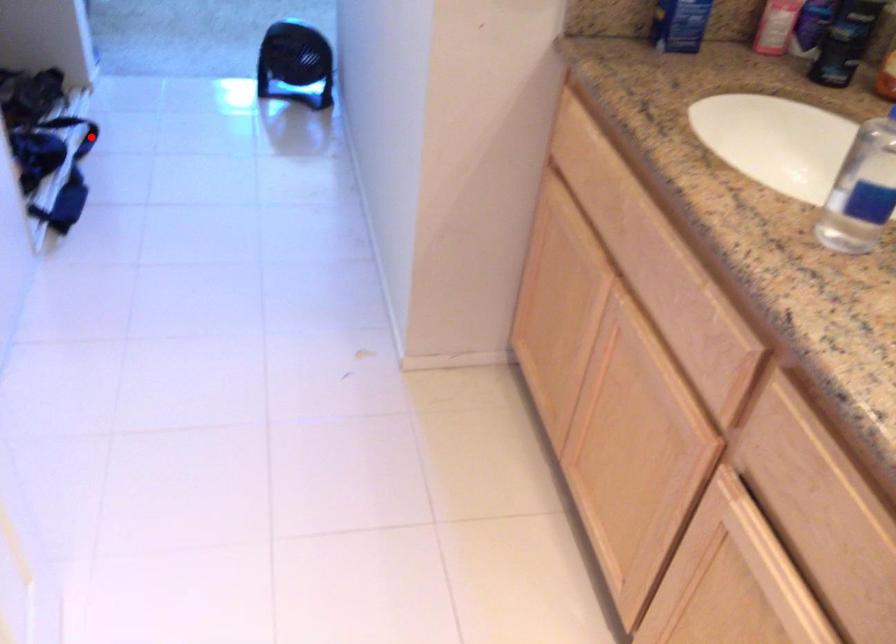
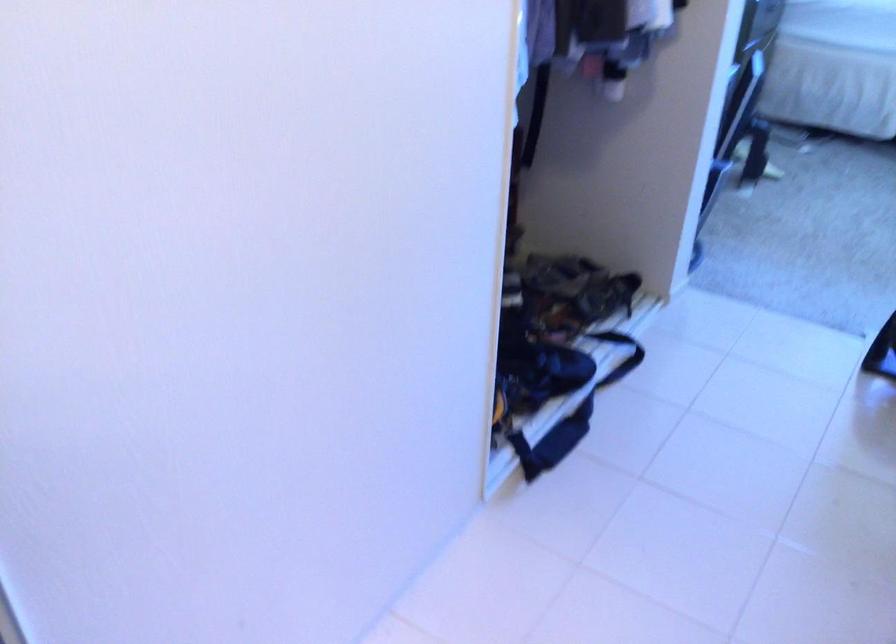
Question: A red point is marked in image1. In image2, is the corresponding 3D point closer to the camera or farther? Reply with the corresponding letter.

Choices:
 (A) The corresponding 3D point is closer.
 (B) The corresponding 3D point is farther.

Answer: (A)